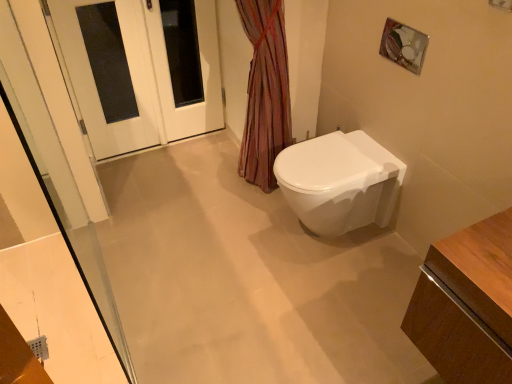
Find the location of a particular element. The height and width of the screenshot is (384, 512). free spot in front of white glossy door at upper left is located at coordinates (191, 166).